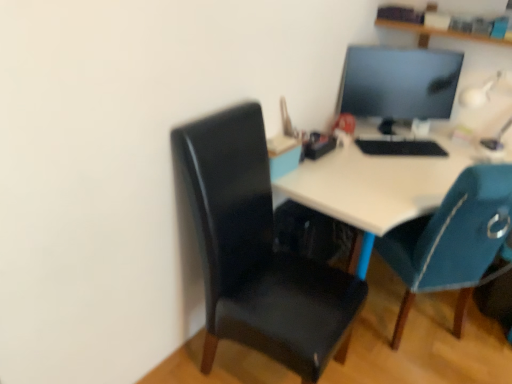
Question: Is teal fabric chair at right, which is counted as the first chair, starting from the right, taller than wooden shelf at upper center?

Choices:
 (A) no
 (B) yes

Answer: (B)

Question: Is the surface of teal fabric chair at right, which is the second chair in left-to-right order, in direct contact with wooden shelf at upper center?

Choices:
 (A) no
 (B) yes

Answer: (A)

Question: Is teal fabric chair at right, which is counted as the first chair, starting from the right, positioned behind wooden shelf at upper center?

Choices:
 (A) no
 (B) yes

Answer: (A)

Question: Is teal fabric chair at right, which is counted as the first chair, starting from the right, located outside wooden shelf at upper center?

Choices:
 (A) yes
 (B) no

Answer: (A)

Question: Is teal fabric chair at right, which is the second chair in left-to-right order, surrounding wooden shelf at upper center?

Choices:
 (A) yes
 (B) no

Answer: (B)

Question: Is point (435, 200) positioned closer to the camera than point (344, 92)?

Choices:
 (A) farther
 (B) closer

Answer: (B)

Question: Do you think white glossy desk at center is within matte black monitor at upper right, or outside of it?

Choices:
 (A) outside
 (B) inside

Answer: (A)

Question: Relative to matte black monitor at upper right, is white glossy desk at center in front or behind?

Choices:
 (A) behind
 (B) front

Answer: (B)

Question: From a real-world perspective, is white glossy desk at center above or below matte black monitor at upper right?

Choices:
 (A) above
 (B) below

Answer: (B)

Question: Considering the relative positions of wooden shelf at upper center and matte black monitor at upper right in the image provided, is wooden shelf at upper center to the left or to the right of matte black monitor at upper right?

Choices:
 (A) right
 (B) left

Answer: (A)

Question: Considering the positions of wooden shelf at upper center and matte black monitor at upper right in the image, is wooden shelf at upper center wider or thinner than matte black monitor at upper right?

Choices:
 (A) wide
 (B) thin

Answer: (A)

Question: From a real-world perspective, is wooden shelf at upper center physically located above or below matte black monitor at upper right?

Choices:
 (A) above
 (B) below

Answer: (A)

Question: From their relative heights in the image, would you say wooden shelf at upper center is taller or shorter than matte black monitor at upper right?

Choices:
 (A) tall
 (B) short

Answer: (B)

Question: Visually, is white glossy table lamp at upper right positioned to the left or to the right of matte black monitor at upper right?

Choices:
 (A) left
 (B) right

Answer: (B)

Question: Considering the positions of white glossy table lamp at upper right and matte black monitor at upper right in the image, is white glossy table lamp at upper right taller or shorter than matte black monitor at upper right?

Choices:
 (A) short
 (B) tall

Answer: (A)